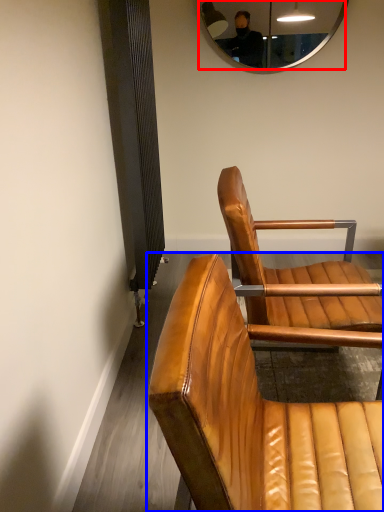
Question: Which object appears farthest to the camera in this image, mirror (highlighted by a red box) or chair (highlighted by a blue box)?

Choices:
 (A) mirror
 (B) chair

Answer: (A)